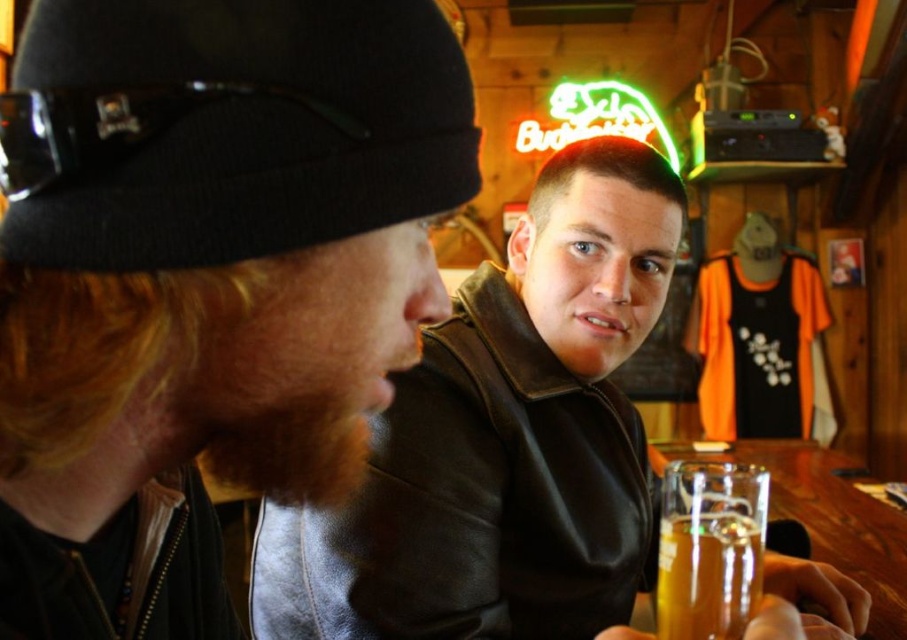
Is leather jacket at center positioned in front of translucent glass beer at lower right?

No, leather jacket at center is further to the viewer.

Who is more distant from viewer, (530, 259) or (706, 625)?

The point (530, 259) is behind.

I want to click on leather jacket at center, so click(x=504, y=438).

Is leather jacket at left in front of black knit cap at upper left?

No.

Is point (201, 532) positioned after point (249, 177)?

Yes, point (201, 532) is farther from viewer.

Locate an element on the screen. Image resolution: width=907 pixels, height=640 pixels. leather jacket at left is located at coordinates (205, 280).

Is leather jacket at center below black knit cap at upper left?

Yes, leather jacket at center is below black knit cap at upper left.

Can you confirm if leather jacket at center is wider than black knit cap at upper left?

Correct, the width of leather jacket at center exceeds that of black knit cap at upper left.

You are a GUI agent. You are given a task and a screenshot of the screen. Output one action in this format:
    pyautogui.click(x=<x>, y=<y>)
    Task: Click on the leather jacket at center
    Image resolution: width=907 pixels, height=640 pixels.
    Given the screenshot: What is the action you would take?
    pyautogui.click(x=504, y=438)